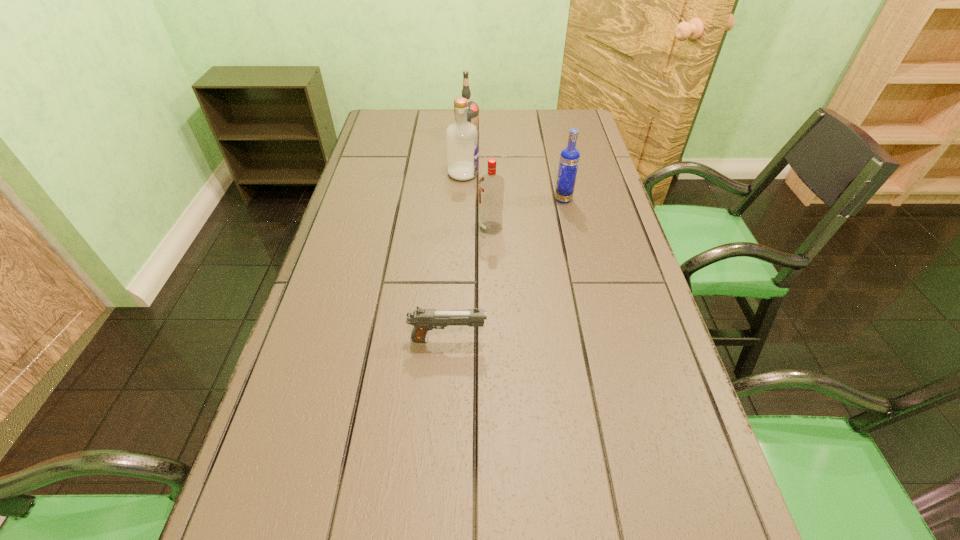
The height and width of the screenshot is (540, 960). What are the coordinates of `vacant region between the farthest object and the rightmost vodka` in the screenshot? It's located at (516, 167).

Image resolution: width=960 pixels, height=540 pixels. What are the coordinates of `free point between the rightmost object and the farthest vodka` in the screenshot? It's located at (516, 167).

At what (x,y) coordinates should I click in order to perform the action: click on empty space that is in between the fourth nearest object and the fourth farthest object. Please return your answer as a coordinate pair (x, y). The image size is (960, 540). Looking at the image, I should click on (477, 201).

Where is `free spot between the second farthest object and the second nearest vodka`? The width and height of the screenshot is (960, 540). free spot between the second farthest object and the second nearest vodka is located at coordinates (514, 186).

Where is `vacant region between the gun and the farthest object`? Image resolution: width=960 pixels, height=540 pixels. vacant region between the gun and the farthest object is located at coordinates (458, 237).

You are a GUI agent. You are given a task and a screenshot of the screen. Output one action in this format:
    pyautogui.click(x=<x>, y=<y>)
    Task: Click on the blank region between the gun and the farthest vodka
    
    Given the screenshot: What is the action you would take?
    pyautogui.click(x=458, y=237)

Locate an element on the screen. This screenshot has width=960, height=540. free space between the second nearest object and the third farthest object is located at coordinates (527, 213).

Select which object is the fourth closest to the second nearest object. Please provide its 2D coordinates. Your answer should be formatted as a tuple, i.e. [(x, y)], where the tuple contains the x and y coordinates of a point satisfying the conditions above.

[(473, 109)]

Locate an element on the screen. The image size is (960, 540). object that stands as the second closest to the fourth nearest object is located at coordinates (491, 186).

Point out which vodka is positioned as the second nearest to the second farthest vodka. Please provide its 2D coordinates. Your answer should be formatted as a tuple, i.e. [(x, y)], where the tuple contains the x and y coordinates of a point satisfying the conditions above.

[(491, 186)]